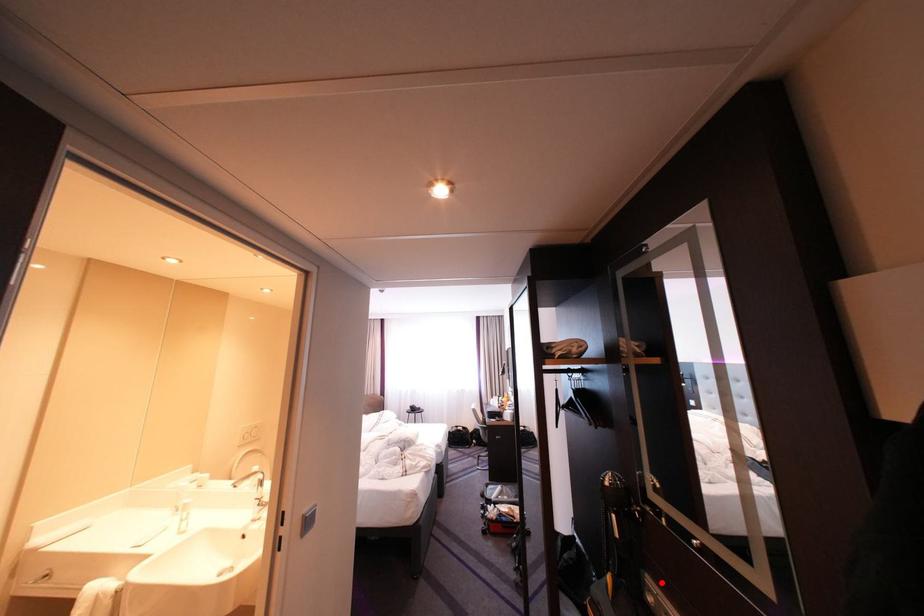
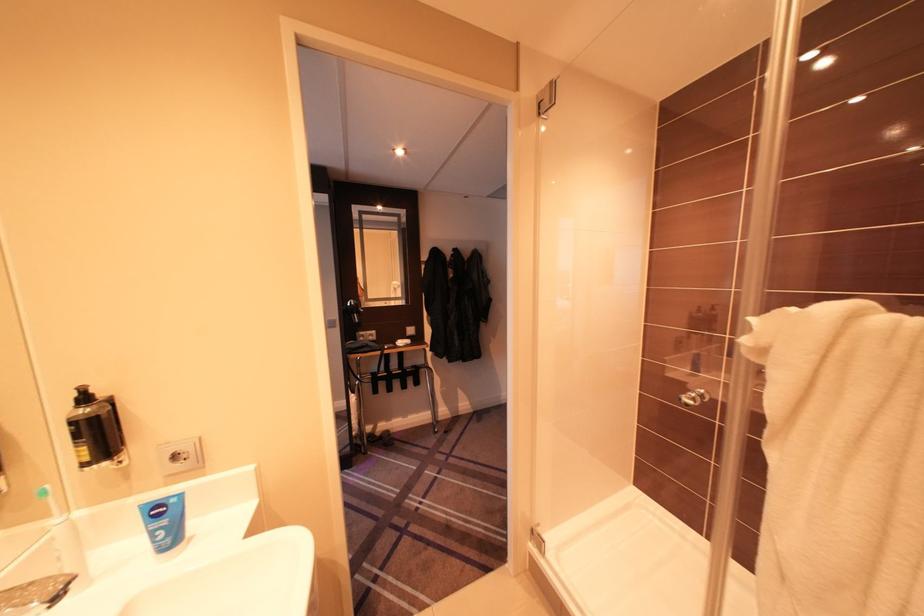
Where in the second image is the point corresponding to the highlighted location from the first image?

(372, 334)